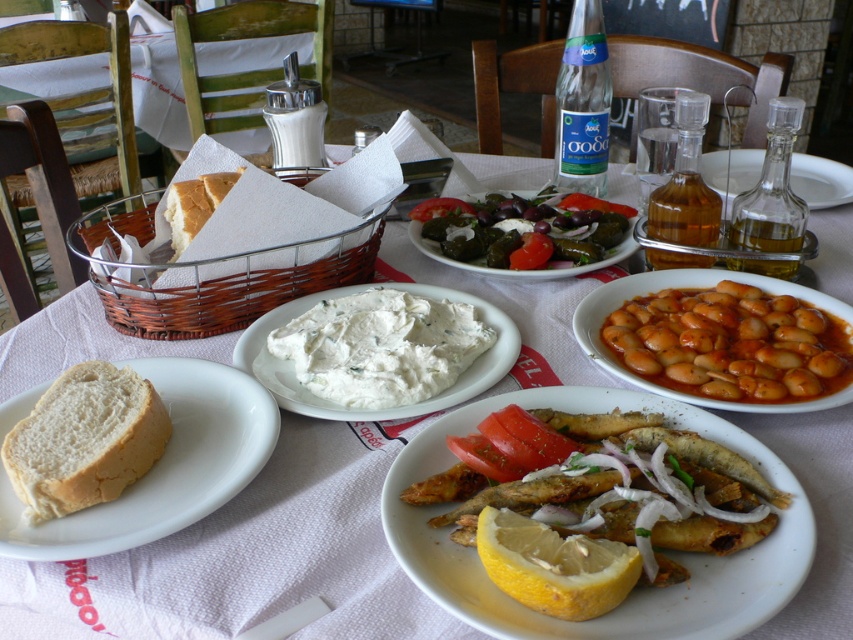
Question: Among these objects, which one is nearest to the camera?

Choices:
 (A) yellow matte lemon at center
 (B) white soft bread at center
 (C) green leafy vegetable at center
 (D) brown matte beans at center right

Answer: (A)

Question: Considering the relative positions of brown matte beans at center right and yellow matte lemon at center in the image provided, where is brown matte beans at center right located with respect to yellow matte lemon at center?

Choices:
 (A) above
 (B) below

Answer: (A)

Question: Among these points, which one is farthest from the camera?

Choices:
 (A) (358, 300)
 (B) (148, 420)
 (C) (730, 150)
 (D) (555, 602)

Answer: (C)

Question: Does white matte bread at lower left appear under yellow matte lemon at center?

Choices:
 (A) no
 (B) yes

Answer: (A)

Question: Among these points, which one is nearest to the camera?

Choices:
 (A) (607, 264)
 (B) (357, 360)
 (C) (822, 364)

Answer: (C)

Question: Is white creamy dip at center above yellow matte lemon at center?

Choices:
 (A) yes
 (B) no

Answer: (A)